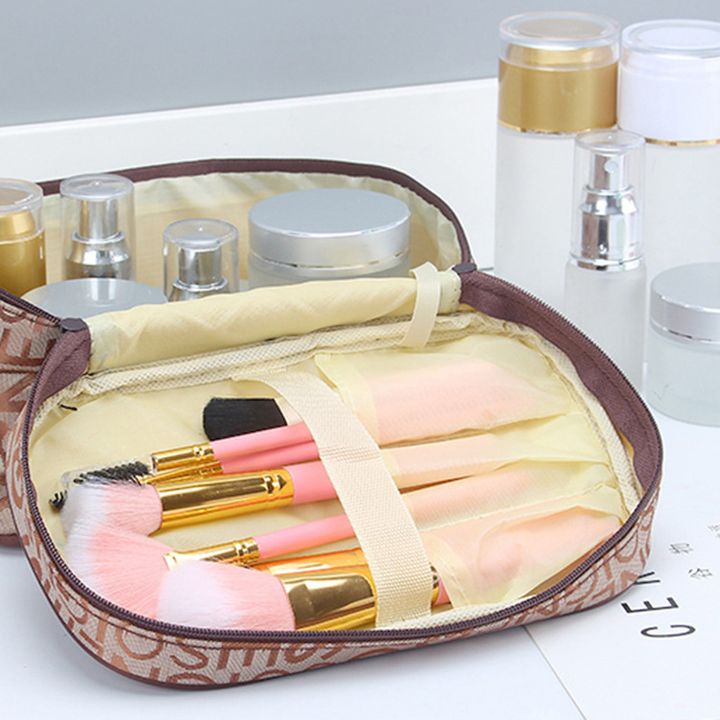
This screenshot has height=720, width=720. I want to click on makeup tools, so click(x=250, y=404), click(x=160, y=454), click(x=176, y=498), click(x=220, y=544), click(x=238, y=593).